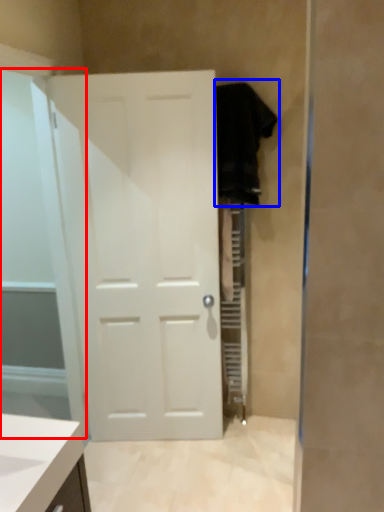
Question: Which point is closer to the camera, glass door (highlighted by a red box) or robe (highlighted by a blue box)?

Choices:
 (A) glass door
 (B) robe

Answer: (A)